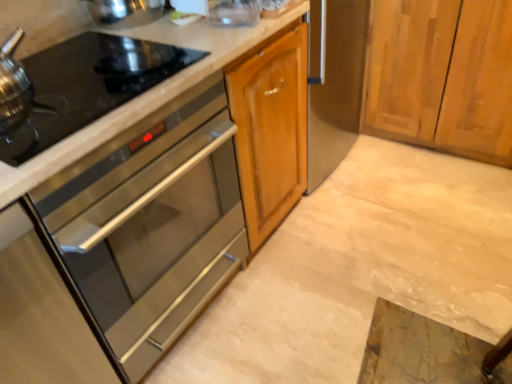
The image size is (512, 384). Identify the location of vacant area that lies to the right of stainless steel oven at left. (302, 301).